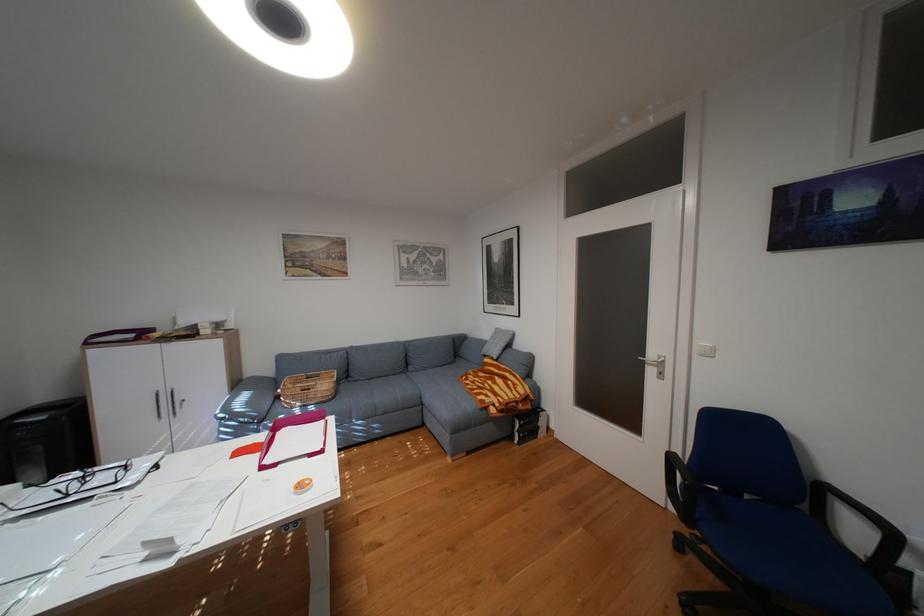
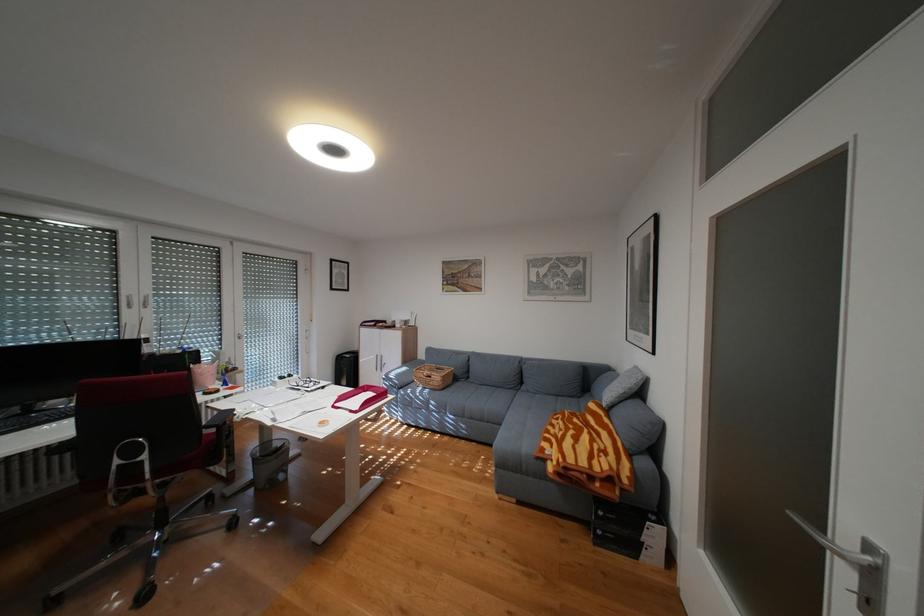
In the second image, find the point that corresponds to pixel 499 395 in the first image.

(564, 445)